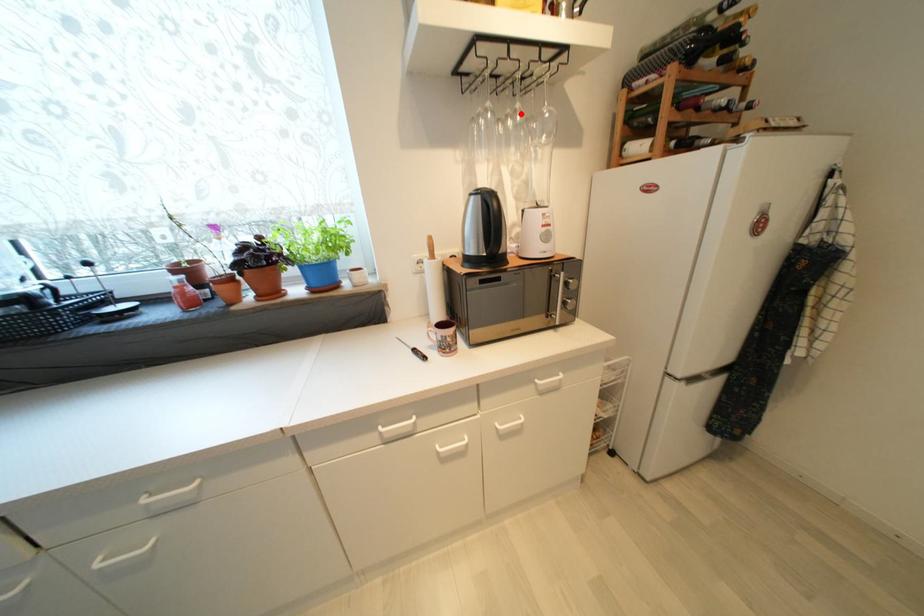
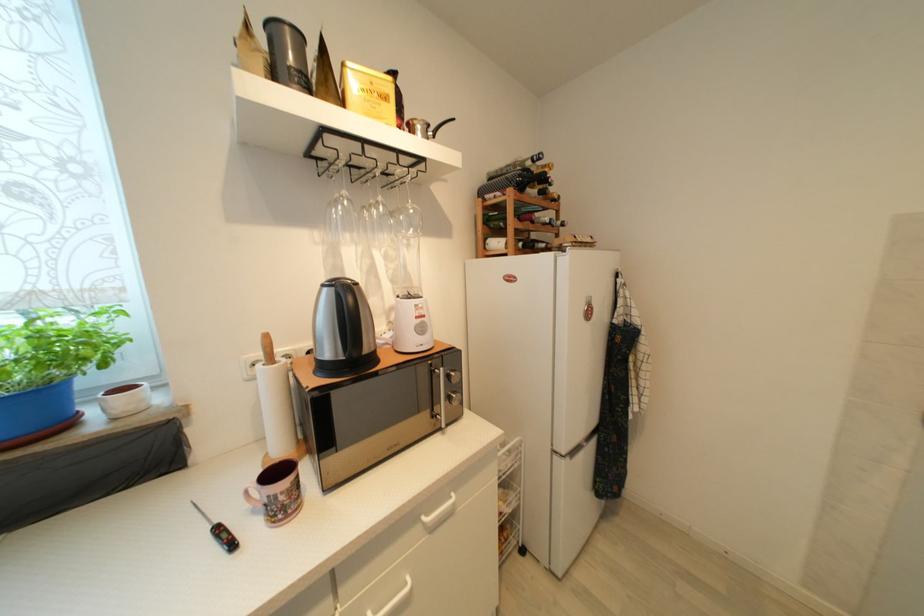
In the second image, find the point that corresponds to the highlighted location in the first image.

(383, 206)